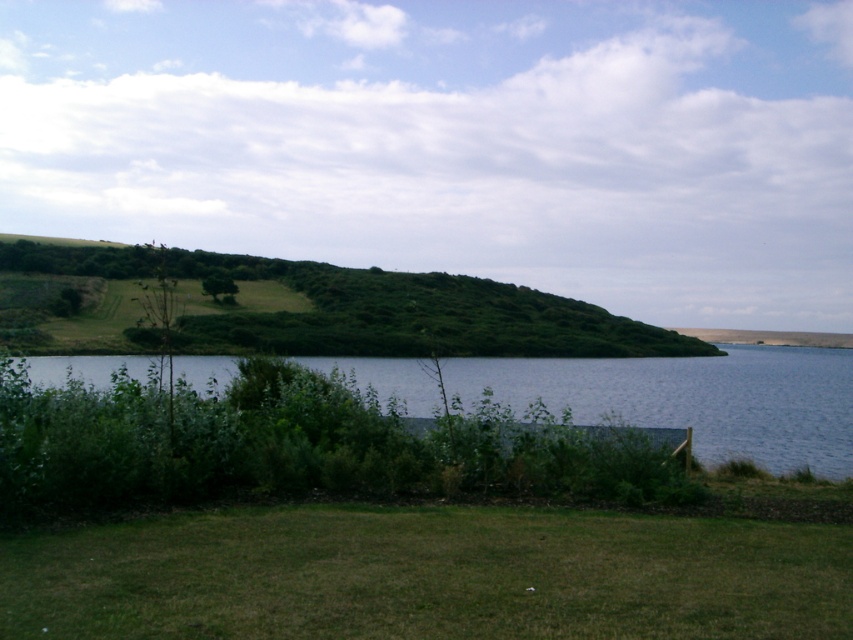
In the scene shown: Based on the scene description, where is the green grassy field at lower center located in the image?

The green grassy field at lower center is located at the 2D coordinate point of (427, 576).

You are standing at the center of the image and want to walk towards the green grassy field at lower center. In which direction should you move?

You should move downward because the green grassy field at lower center is located at point (427, 576), which is below the center of the image.

You are standing at the point labeled as point (x=693, y=397) in the image. Based on the scene description, what would you most likely see around you?

The point (x=693, y=397) corresponds to blue water at center, so you would most likely see the calm expanse of water reflecting the partly cloudy sky around you.